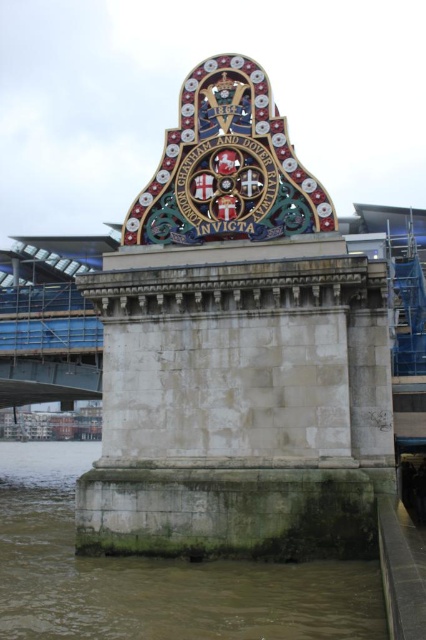
Question: Which object appears closest to the camera in this image?

Choices:
 (A) shiny metallic crest at center
 (B) multicolored mosaic crest at center

Answer: (B)

Question: Is brown stone river at lower left positioned at the back of shiny metallic crest at center?

Choices:
 (A) yes
 (B) no

Answer: (B)

Question: In this image, where is multicolored mosaic crest at center located relative to shiny metallic crest at center?

Choices:
 (A) below
 (B) above

Answer: (B)

Question: Can you confirm if brown stone river at lower left is positioned to the right of multicolored mosaic crest at center?

Choices:
 (A) yes
 (B) no

Answer: (B)

Question: Which object is the farthest from the multicolored mosaic crest at center?

Choices:
 (A) shiny metallic crest at center
 (B) brown stone river at lower left

Answer: (B)

Question: Based on their relative distances, which object is farther from the shiny metallic crest at center?

Choices:
 (A) brown stone river at lower left
 (B) multicolored mosaic crest at center

Answer: (A)